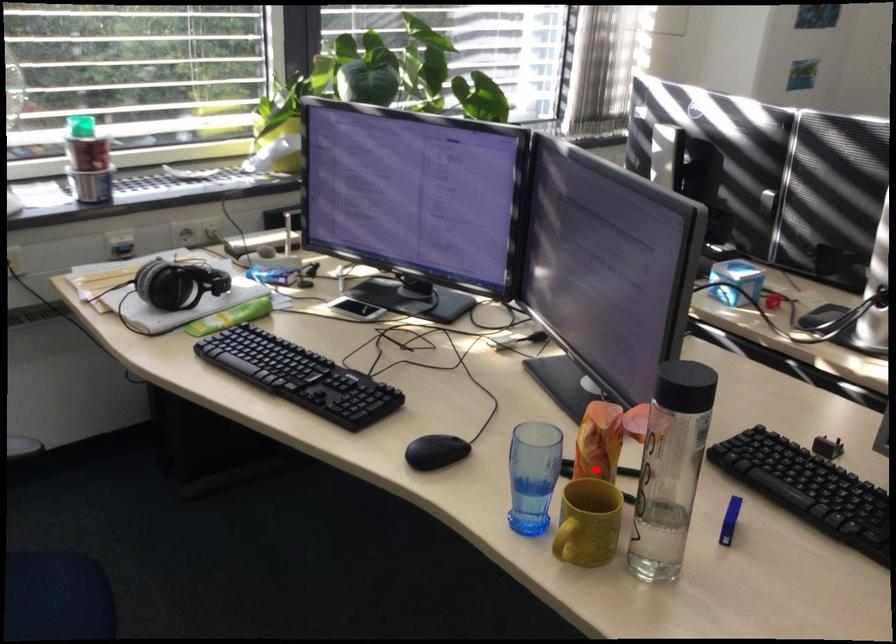
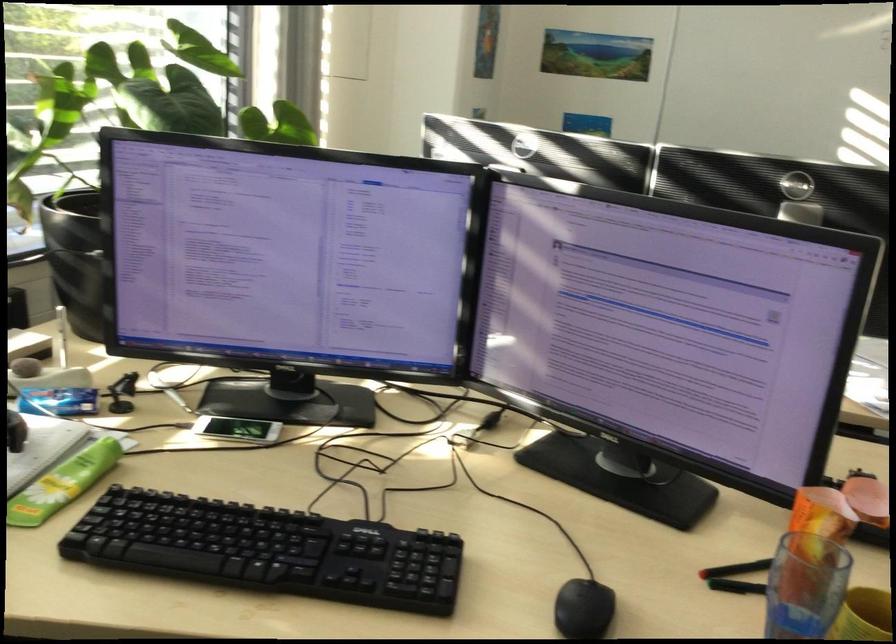
Find the pixel in the second image that matches the highlighted location in the first image.

(736, 569)